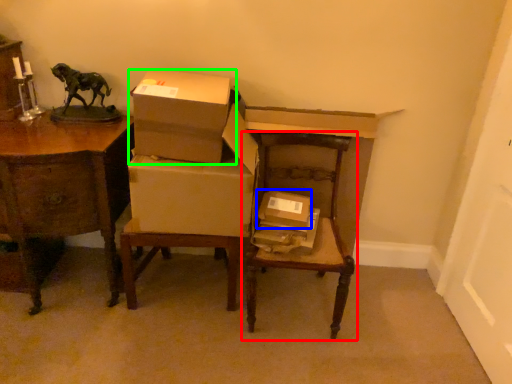
Question: Which object is positioned closest to chair (highlighted by a red box)? Select from box (highlighted by a blue box) and box (highlighted by a green box).

Choices:
 (A) box
 (B) box

Answer: (A)